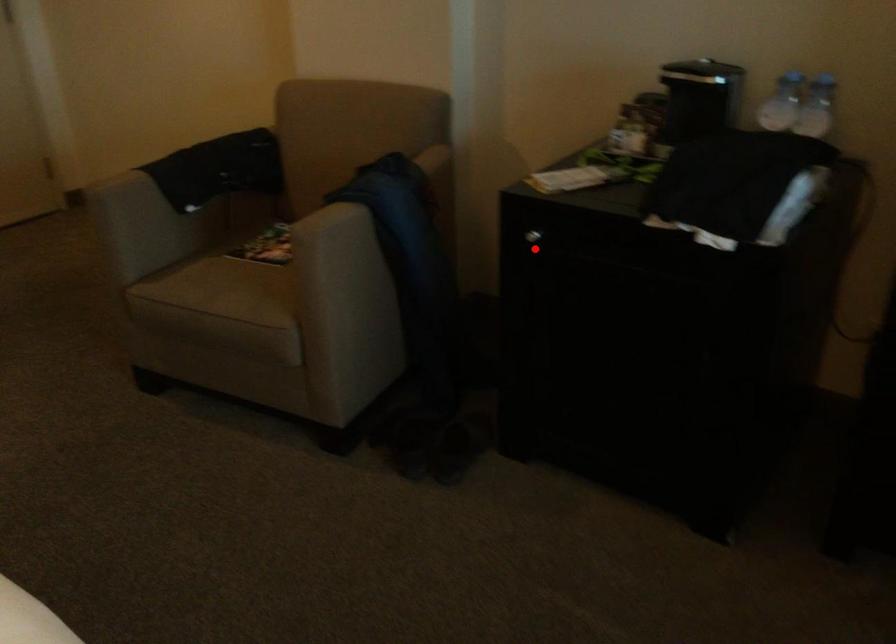
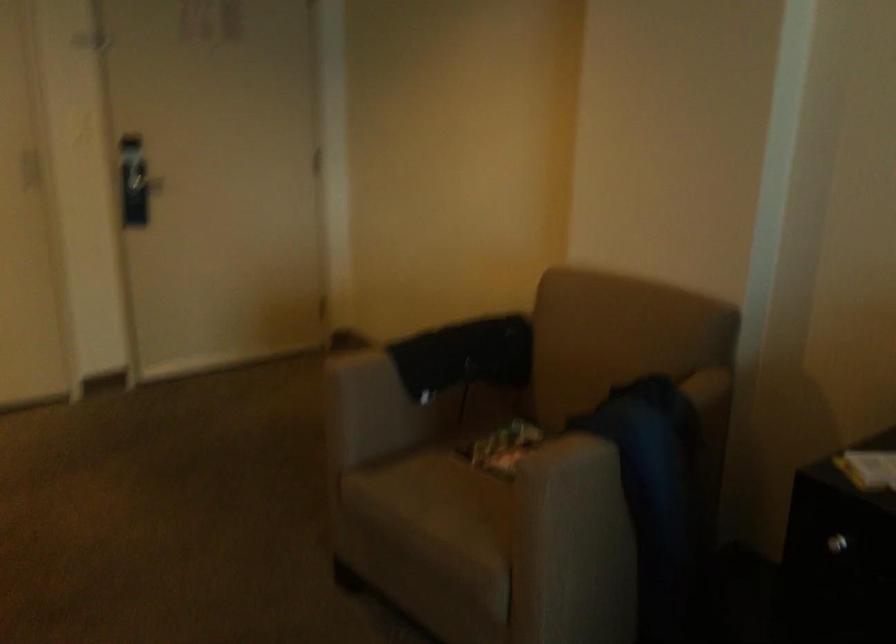
In the second image, find the point that corresponds to the highlighted location in the first image.

(833, 556)